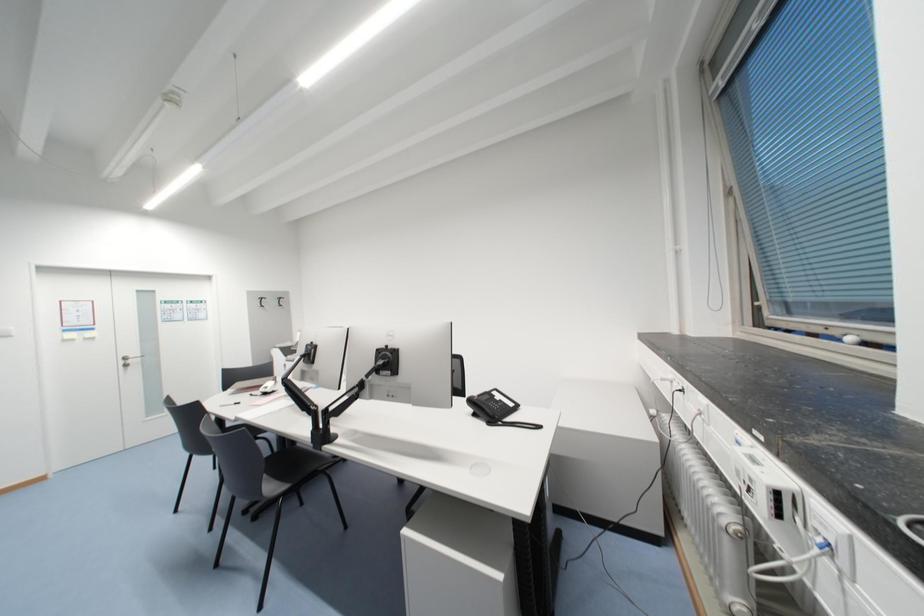
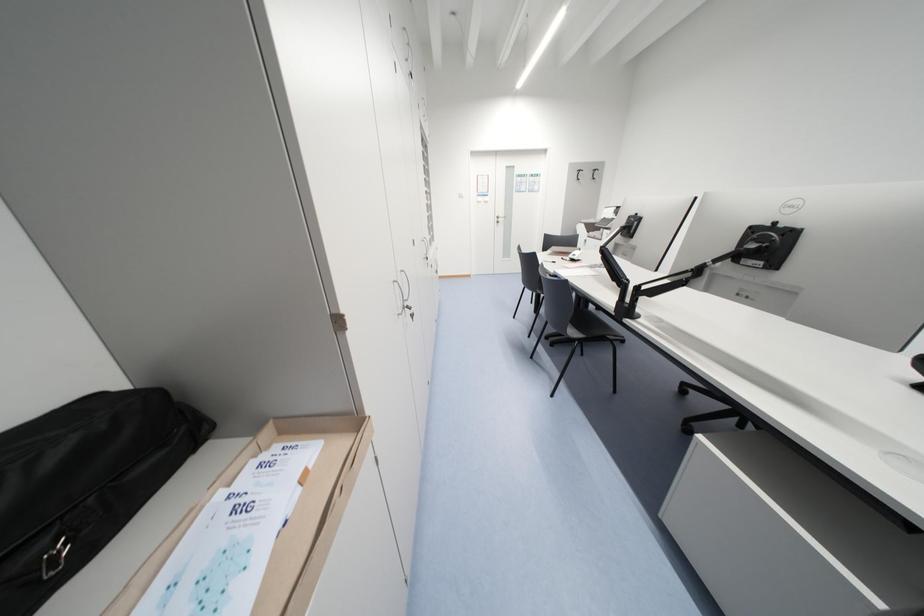
Consider the image. Based on the continuous images, in which direction is the camera rotating?

The rotation direction of the camera is left-down.